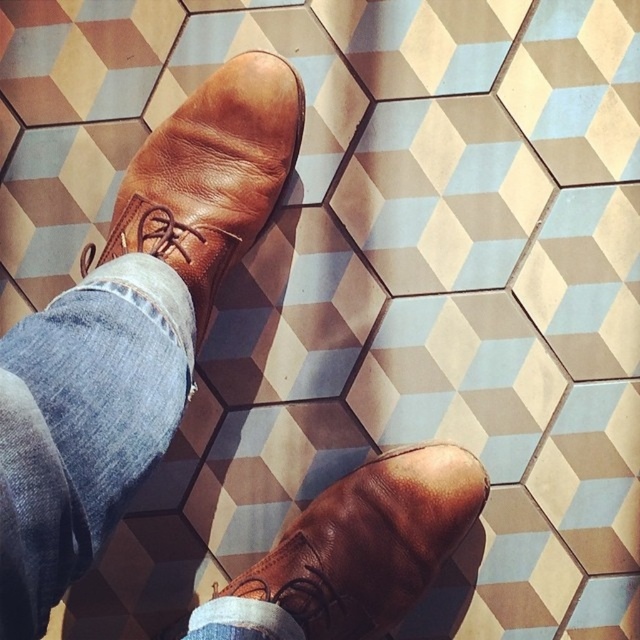
Question: Which of these objects is positioned farthest from the light blue textured tile at center?

Choices:
 (A) brown leather shoe at lower right
 (B) brown leather shoe at upper left
 (C) denim at left

Answer: (C)

Question: Is denim at left wider than brown leather shoe at upper left?

Choices:
 (A) yes
 (B) no

Answer: (B)

Question: Can you confirm if denim at left is positioned to the right of brown leather shoe at lower right?

Choices:
 (A) no
 (B) yes

Answer: (A)

Question: Which object is the farthest from the brown leather shoe at upper left?

Choices:
 (A) light blue textured tile at center
 (B) brown leather shoe at lower right

Answer: (B)

Question: Is denim at left to the right of brown leather shoe at upper left from the viewer's perspective?

Choices:
 (A) no
 (B) yes

Answer: (A)

Question: Which point is closer to the camera?

Choices:
 (A) denim at left
 (B) brown leather shoe at upper left
 (C) light blue textured tile at center
 (D) brown leather shoe at lower right

Answer: (A)